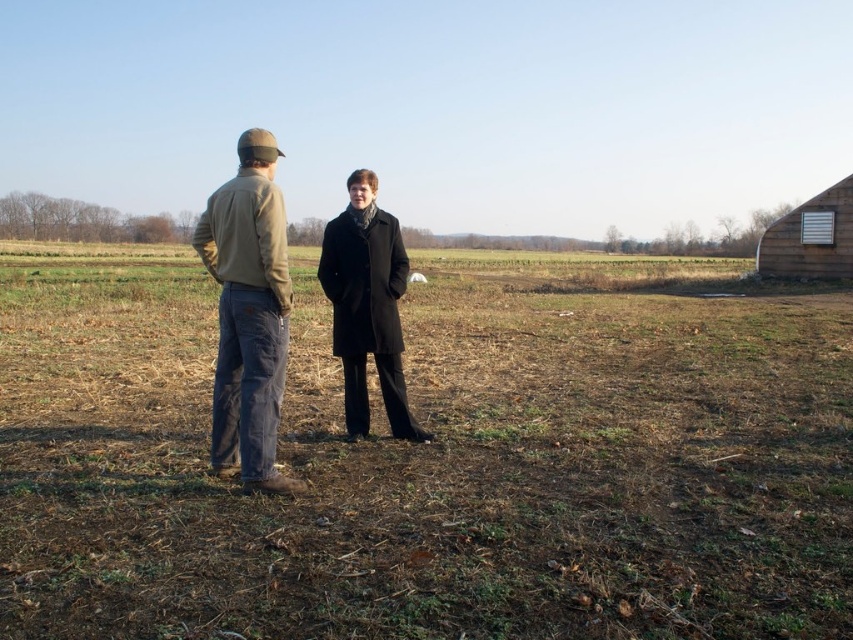
Two people are standing in a field. The person on the left is wearing a khaki cotton jacket at center. The person on the right is wearing a dark coat. They want to exchange a book without moving closer. The book is 0.3 meters thick. Can they do this?

The two people are 3.73 meters apart. The book is 0.3 meters thick. Since the distance between them is much greater than the book thickness, they cannot exchange the book without moving closer.

In the scene shown: You are standing at the origin point of the coordinate system. You want to walk to the brown grass at center. Which direction should you move in to reach it?

The brown grass at center is located at point (428, 460), so you should move towards the northeast direction to reach it.